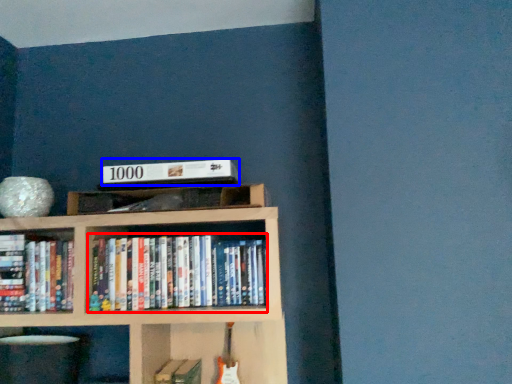
Question: Which of the following is the farthest to the observer, book (highlighted by a red box) or paperback book (highlighted by a blue box)?

Choices:
 (A) book
 (B) paperback book

Answer: (B)